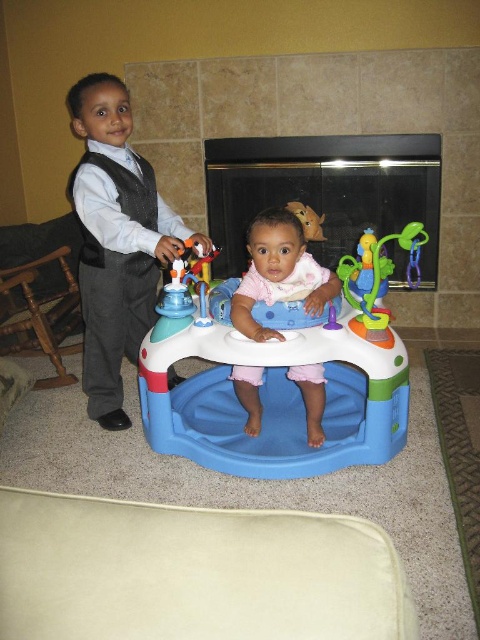
Consider the image. Does matte gray vest at left have a greater height compared to translucent plastic toy at center?

Correct, matte gray vest at left is much taller as translucent plastic toy at center.

Is matte gray vest at left positioned before translucent plastic toy at center?

No, matte gray vest at left is behind translucent plastic toy at center.

Which is behind, point (96, 188) or point (385, 284)?

The point (385, 284) is more distant.

This screenshot has width=480, height=640. What are the coordinates of `matte gray vest at left` in the screenshot? It's located at (117, 241).

Does wooden chair at left have a lesser width compared to translucent plastic toy at center?

In fact, wooden chair at left might be wider than translucent plastic toy at center.

Who is shorter, wooden chair at left or translucent plastic toy at center?

Standing shorter between the two is translucent plastic toy at center.

Identify the location of wooden chair at left. The width and height of the screenshot is (480, 640). (41, 317).

Is the position of blue plastic baby activity center at center less distant than that of wooden chair at left?

Yes.

Is blue plastic baby activity center at center above wooden chair at left?

No.

Does point (213, 371) lie behind point (46, 353)?

No, (213, 371) is closer to viewer.

Find the location of a particular element. The image size is (480, 640). blue plastic baby activity center at center is located at coordinates (275, 394).